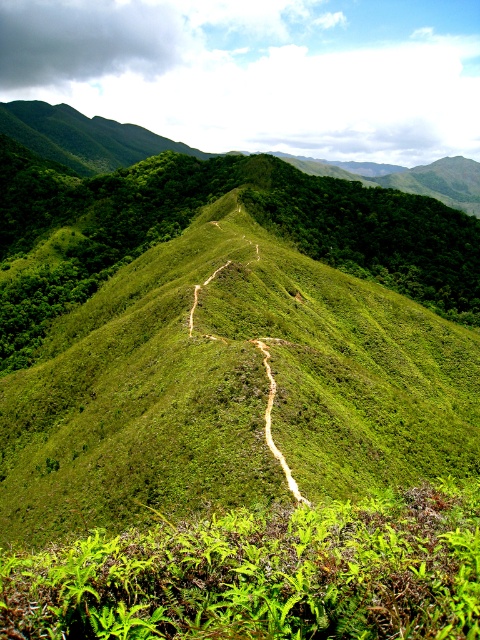
You are a hiker who wants to take a photo of the green leafy vegetation at center. Where should you stand to capture it in the frame?

The green leafy vegetation at center is located at coordinates point (192, 216), so you should position yourself facing that point to include it in your photo.

You are hiking on the mountain path and want to reach the point at coordinates (265, 420). You currently stand at the point at coordinates (432, 234). Which direction should you move relative to your current position to get closer to your destination?

You should move downward because point (432, 234) is further to the camera than point (265, 420), meaning it is closer to you. To reach the destination, you need to descend towards the lower part of the scene.